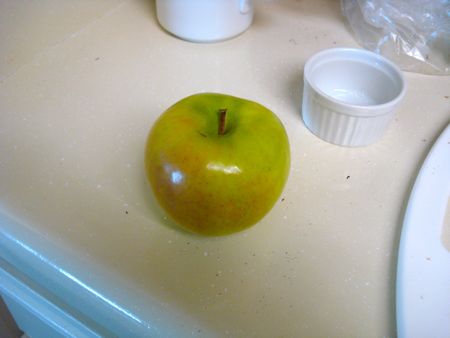
Where is `plate`? The image size is (450, 338). plate is located at coordinates pos(414,262).